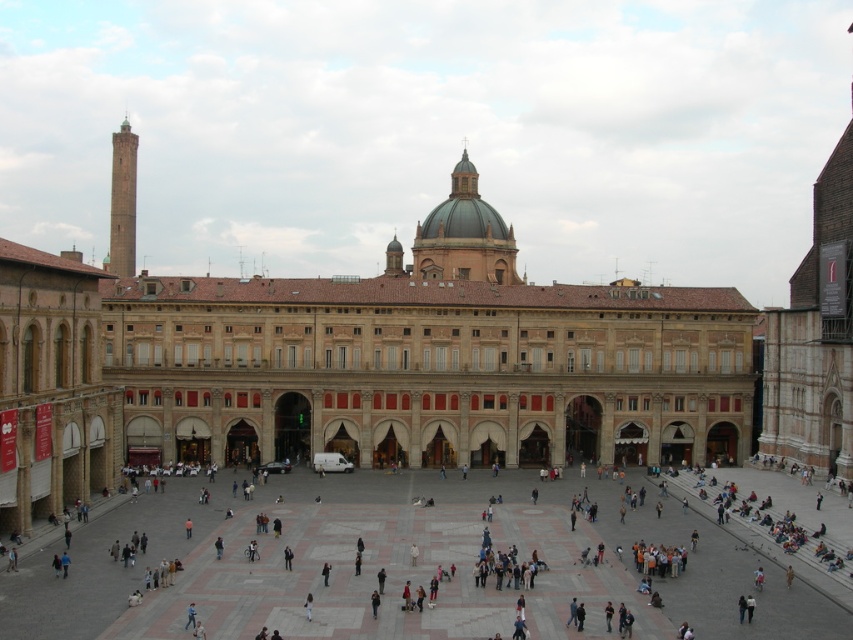
Question: Can you confirm if brown stone building at center is smaller than marble tiles at center?

Choices:
 (A) yes
 (B) no

Answer: (B)

Question: Which of the following is the closest to the observer?

Choices:
 (A) marble tiles at center
 (B) brown stone building at center

Answer: (A)

Question: Can you confirm if brown stone building at center is positioned below marble tiles at center?

Choices:
 (A) yes
 (B) no

Answer: (B)

Question: Considering the relative positions of brown stone building at center and marble tiles at center in the image provided, where is brown stone building at center located with respect to marble tiles at center?

Choices:
 (A) above
 (B) below

Answer: (A)

Question: Which point appears closest to the camera in this image?

Choices:
 (A) (782, 628)
 (B) (730, 339)

Answer: (A)